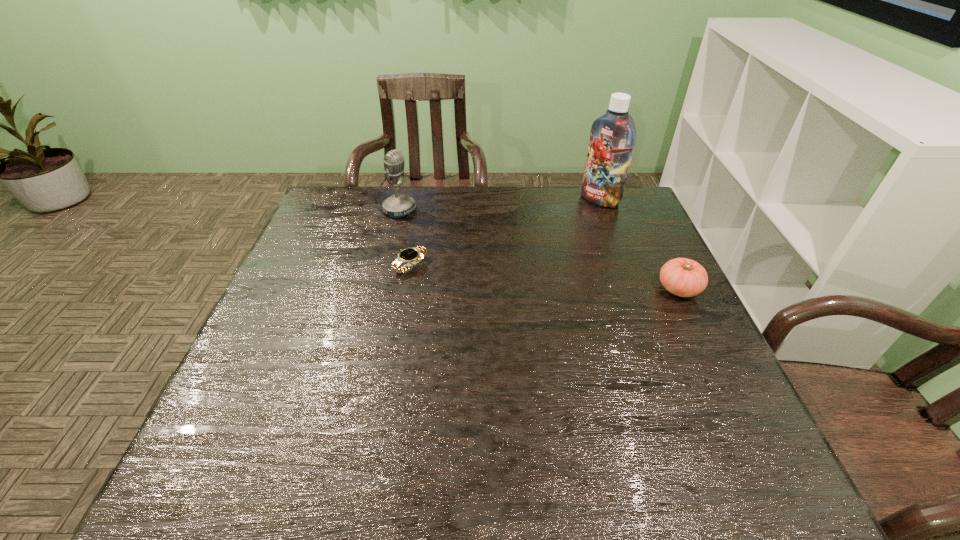
In order to click on free space between the microphone and the tallest object in this screenshot , I will do `click(499, 205)`.

Find the location of `empty space that is in between the watch and the microphone`. empty space that is in between the watch and the microphone is located at coordinates click(x=405, y=238).

At what (x,y) coordinates should I click in order to perform the action: click on blank region between the third object from left to right and the second tallest object. Please return your answer as a coordinate pair (x, y). The image size is (960, 540). Looking at the image, I should click on (499, 205).

Find the location of `vacant point located between the tomato and the shampoo`. vacant point located between the tomato and the shampoo is located at coordinates (639, 244).

This screenshot has height=540, width=960. What are the coordinates of `the second closest object to the watch` in the screenshot? It's located at (612, 136).

This screenshot has width=960, height=540. Find the location of `object that is the nearest to the tomato`. object that is the nearest to the tomato is located at coordinates (612, 136).

Find the location of `vacant space that satisfies the following two spatial constraints: 1. on the back side of the second object from right to left; 2. on the right side of the microphone`. vacant space that satisfies the following two spatial constraints: 1. on the back side of the second object from right to left; 2. on the right side of the microphone is located at coordinates (402, 200).

At what (x,y) coordinates should I click in order to perform the action: click on free location that satisfies the following two spatial constraints: 1. on the back side of the watch; 2. on the right side of the tallest object. Please return your answer as a coordinate pair (x, y). The image size is (960, 540). Looking at the image, I should click on (422, 200).

Locate an element on the screen. Image resolution: width=960 pixels, height=540 pixels. vacant area in the image that satisfies the following two spatial constraints: 1. on the back side of the tallest object; 2. on the right side of the watch is located at coordinates (422, 200).